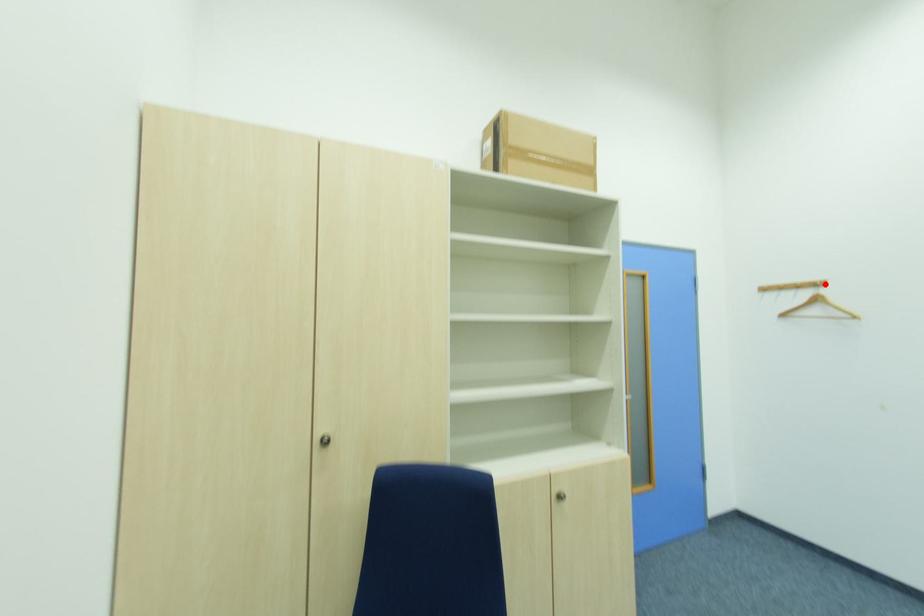
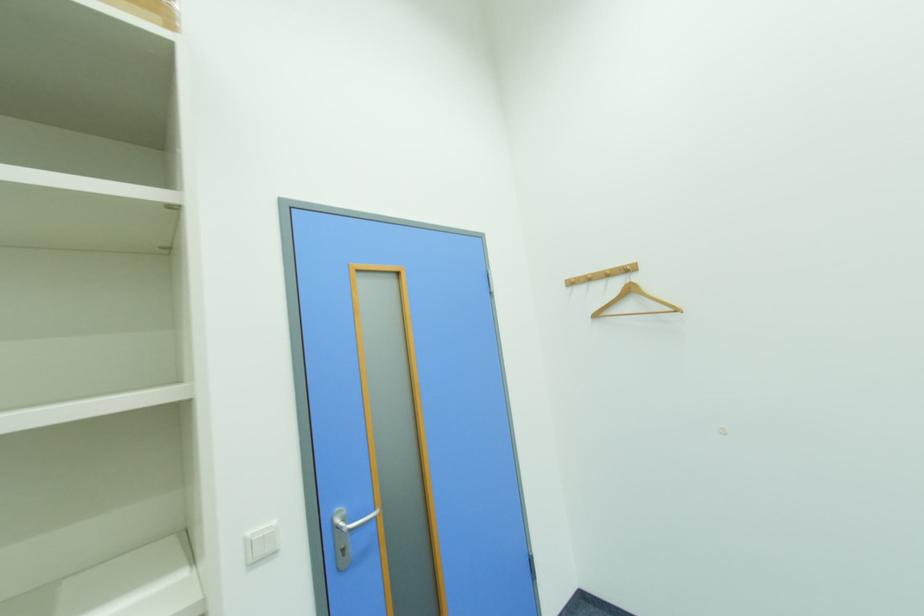
In the second image, find the point that corresponds to the highlighted location in the first image.

(634, 267)